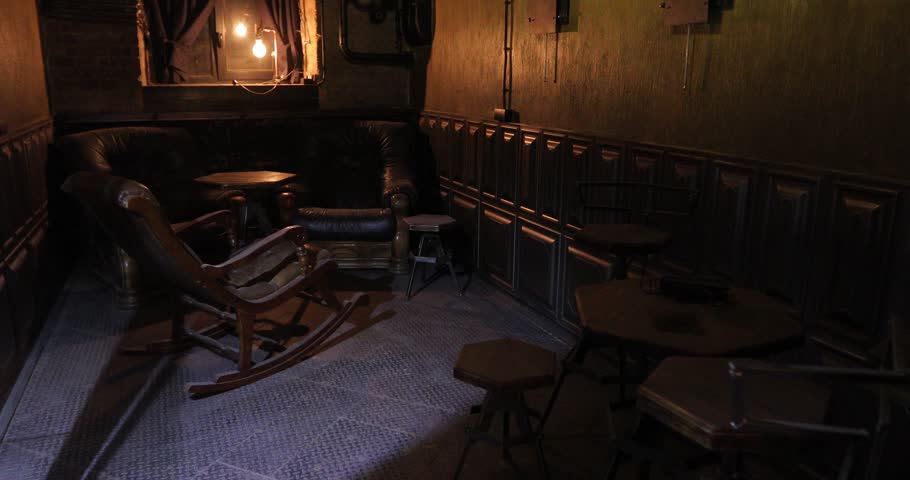
I want to click on chair, so click(114, 152).